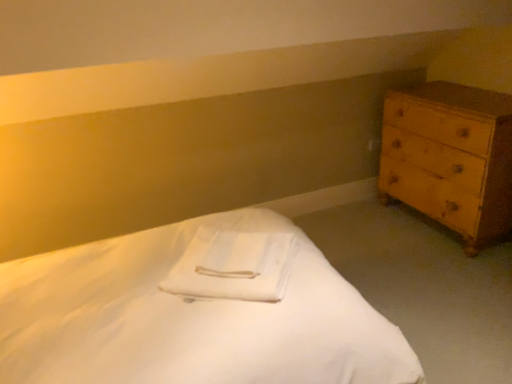
Where is `vacant area on top of light brown wooden chest of drawers at right (from a real-world perspective)`? This screenshot has height=384, width=512. vacant area on top of light brown wooden chest of drawers at right (from a real-world perspective) is located at coordinates (469, 97).